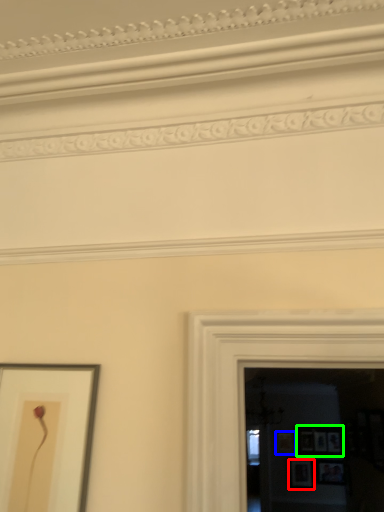
Question: Which is nearer to the picture frame (highlighted by a red box)? picture frame (highlighted by a blue box) or picture frame (highlighted by a green box).

Choices:
 (A) picture frame
 (B) picture frame

Answer: (A)